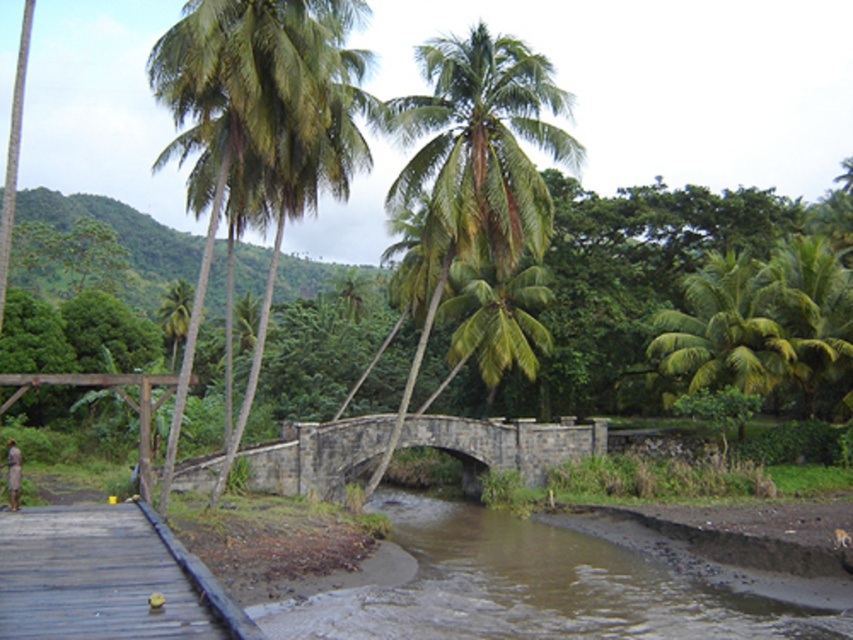
Question: Which object appears farthest from the camera in this image?

Choices:
 (A) brown textured shirt at lower left
 (B) brown muddy water at lower center
 (C) green leafy coconut trees at upper left
 (D) stone bridge at center

Answer: (D)

Question: Does brown muddy water at lower center have a smaller size compared to brown textured shirt at lower left?

Choices:
 (A) yes
 (B) no

Answer: (B)

Question: Estimate the real-world distances between objects in this image. Which object is closer to the brown textured shirt at lower left?

Choices:
 (A) stone bridge at center
 (B) brown muddy water at lower center

Answer: (B)

Question: Estimate the real-world distances between objects in this image. Which object is closer to the green leafy coconut trees at upper left?

Choices:
 (A) brown textured shirt at lower left
 (B) stone bridge at center

Answer: (B)

Question: Is brown muddy water at lower center positioned behind brown textured shirt at lower left?

Choices:
 (A) yes
 (B) no

Answer: (B)

Question: Is the position of green leafy coconut trees at upper left more distant than that of stone bridge at center?

Choices:
 (A) yes
 (B) no

Answer: (B)